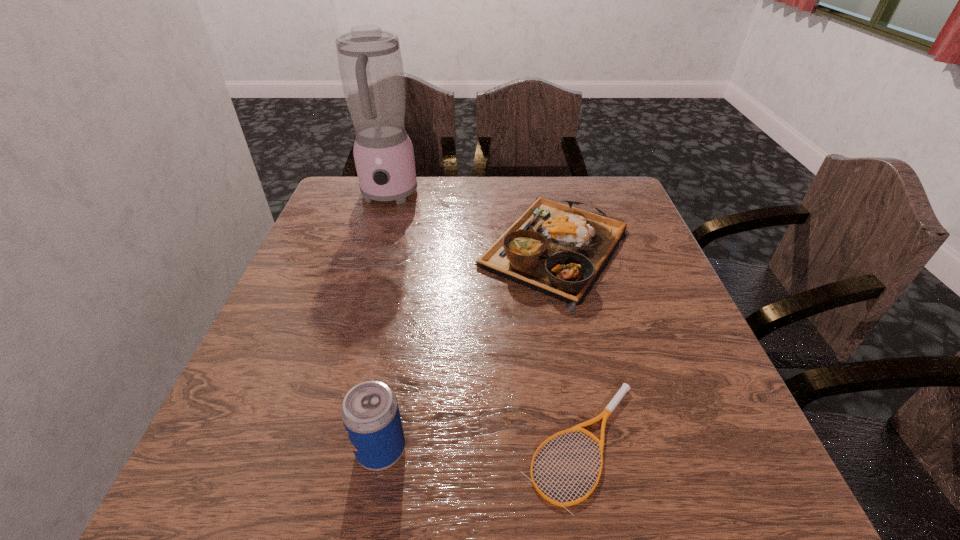
Identify the location of beer can that is at the near edge. Image resolution: width=960 pixels, height=540 pixels. (370, 413).

Where is `tennis racket located in the near edge section of the desktop`? Image resolution: width=960 pixels, height=540 pixels. tennis racket located in the near edge section of the desktop is located at coordinates (606, 413).

This screenshot has height=540, width=960. What are the coordinates of `object located at the left edge` in the screenshot? It's located at (370, 63).

You are a GUI agent. You are given a task and a screenshot of the screen. Output one action in this format:
    pyautogui.click(x=<x>, y=<y>)
    Task: Click on the object situated at the right edge
    The image size is (960, 540).
    Given the screenshot: What is the action you would take?
    pyautogui.click(x=559, y=250)

At what (x,y) coordinates should I click in order to perform the action: click on object positioned at the far left corner. Please return your answer as a coordinate pair (x, y). Looking at the image, I should click on (370, 63).

I want to click on object that is positioned at the far right corner, so pos(559,250).

Find the location of `vacant space at the far edge`. vacant space at the far edge is located at coordinates (468, 199).

In order to click on vacant region at the near edge of the desktop in this screenshot , I will do `click(465, 501)`.

You are a GUI agent. You are given a task and a screenshot of the screen. Output one action in this format:
    pyautogui.click(x=<x>, y=<y>)
    Task: Click on the vacant region at the left edge of the desktop
    The image size is (960, 540).
    Given the screenshot: What is the action you would take?
    pyautogui.click(x=311, y=267)

The width and height of the screenshot is (960, 540). In the image, there is a desktop. Find the location of `free region at the right edge`. free region at the right edge is located at coordinates (715, 384).